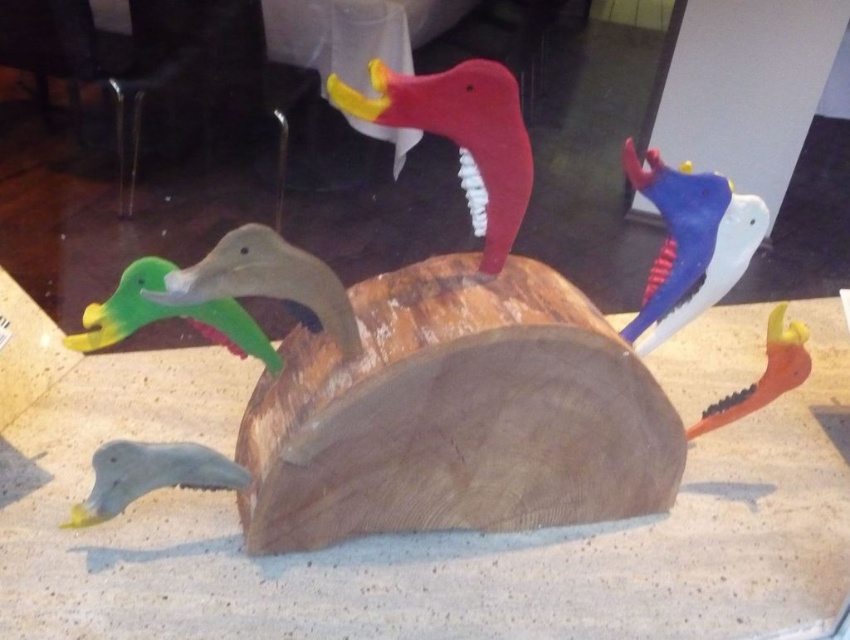
You are an art student analyzing the sculpture. You notice the white matte bird at upper right and the matte gray duck at lower left. Which of these two birds is taller?

The white matte bird at upper right is taller than the matte gray duck at lower left.

You are a birdwatcher observing the sculpture. Which bird is located higher up between the white matte bird at upper right and the matte green plastic duck at center?

The white matte bird at upper right is positioned over the matte green plastic duck at center, so it is higher up.